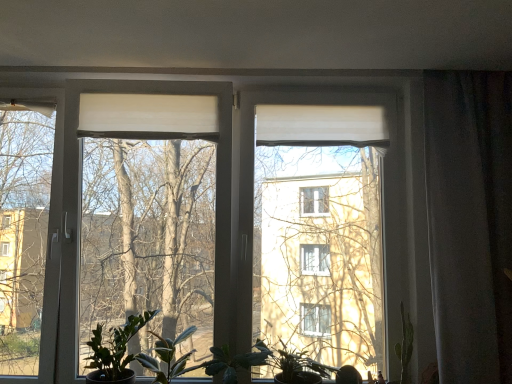
Describe the element at coordinates (169, 358) in the screenshot. I see `green matte leafy plant at lower center, arranged as the 2th houseplant when viewed from the right` at that location.

How much space does green matte plant at lower left, the first houseplant in the left-to-right sequence, occupy vertically?

It is 31.60 centimeters.

Image resolution: width=512 pixels, height=384 pixels. What do you see at coordinates (115, 351) in the screenshot? I see `green matte plant at lower left, the first houseplant in the left-to-right sequence` at bounding box center [115, 351].

This screenshot has width=512, height=384. Identify the location of green matte leafy plant at center. pos(234,361).

This screenshot has height=384, width=512. What do you see at coordinates (294, 365) in the screenshot? I see `green matte plant at lower center, marked as the first houseplant in a right-to-left arrangement` at bounding box center [294, 365].

Where is `green matte leafy plant at lower center, arranged as the 2th houseplant when viewed from the right`? Image resolution: width=512 pixels, height=384 pixels. green matte leafy plant at lower center, arranged as the 2th houseplant when viewed from the right is located at coordinates (169, 358).

Based on the photo, visually, is green matte plant at lower center, the third houseplant viewed from the left, positioned to the left or to the right of white matte curtain at right?

green matte plant at lower center, the third houseplant viewed from the left, is to the left of white matte curtain at right.

Choose the correct answer: Is green matte plant at lower center, the third houseplant viewed from the left, inside white matte curtain at right or outside it?

The correct answer is: outside.

Is green matte plant at lower center, the third houseplant viewed from the left, placed right next to white matte curtain at right?

No, green matte plant at lower center, the third houseplant viewed from the left, is not with white matte curtain at right.

Could you tell me if green matte plant at lower center, the third houseplant viewed from the left, is turned towards white matte curtain at right?

No, green matte plant at lower center, the third houseplant viewed from the left, is not turned towards white matte curtain at right.

Looking at their sizes, would you say green matte plant at lower left, the first houseplant in the left-to-right sequence, is wider or thinner than green matte leafy plant at center?

Considering their sizes, green matte plant at lower left, the first houseplant in the left-to-right sequence, looks slimmer than green matte leafy plant at center.

Is green matte plant at lower left, which appears as the 3th houseplant when viewed from the right, aimed at green matte leafy plant at center?

No, green matte plant at lower left, which appears as the 3th houseplant when viewed from the right, is not oriented towards green matte leafy plant at center.

Which is behind, point (111, 375) or point (234, 377)?

The point (234, 377) is behind.

From the image's perspective, does green matte plant at lower left, the first houseplant in the left-to-right sequence, appear lower than green matte leafy plant at center?

No, from the image's perspective, green matte plant at lower left, the first houseplant in the left-to-right sequence, is not beneath green matte leafy plant at center.

Considering the relative sizes of white matte curtain at right and green matte plant at lower left, which appears as the 3th houseplant when viewed from the right, in the image provided, is white matte curtain at right wider than green matte plant at lower left, which appears as the 3th houseplant when viewed from the right,?

Incorrect, the width of white matte curtain at right does not surpass that of green matte plant at lower left, which appears as the 3th houseplant when viewed from the right.

Is white matte curtain at right facing away from green matte plant at lower left, which appears as the 3th houseplant when viewed from the right?

That's not correct — white matte curtain at right is not looking away from green matte plant at lower left, which appears as the 3th houseplant when viewed from the right.

Considering the positions of points (437, 208) and (93, 332), is point (437, 208) closer to camera compared to point (93, 332)?

Yes.

In terms of size, does white matte curtain at right appear bigger or smaller than green matte plant at lower left, which appears as the 3th houseplant when viewed from the right?

Clearly, white matte curtain at right is larger in size than green matte plant at lower left, which appears as the 3th houseplant when viewed from the right.

From a real-world perspective, is green matte plant at lower left, the first houseplant in the left-to-right sequence, under white matte curtain at right?

Yes, from a real-world perspective, green matte plant at lower left, the first houseplant in the left-to-right sequence, is below white matte curtain at right.

Is point (122, 382) behind point (454, 233)?

That is False.

Which houseplant is the 3rd one when counting from the left side of the white matte curtain at right? Please provide its 2D coordinates.

[(115, 351)]

Is point (205, 373) farther from camera compared to point (177, 370)?

Yes, point (205, 373) is behind point (177, 370).

How much distance is there between green matte leafy plant at center and green matte leafy plant at lower center, arranged as the 2th houseplant when viewed from the right?

green matte leafy plant at center is 6.84 inches from green matte leafy plant at lower center, arranged as the 2th houseplant when viewed from the right.

Which of these two, green matte leafy plant at center or green matte leafy plant at lower center, the 2th houseplant in the left-to-right sequence, is smaller?

Smaller between the two is green matte leafy plant at center.

From the image's perspective, which is above, green matte leafy plant at center or green matte leafy plant at lower center, the 2th houseplant in the left-to-right sequence?

green matte leafy plant at lower center, the 2th houseplant in the left-to-right sequence, appears higher in the image.

Which object is positioned more to the right, green matte leafy plant at lower center, arranged as the 2th houseplant when viewed from the right, or green matte plant at lower center, marked as the first houseplant in a right-to-left arrangement?

green matte plant at lower center, marked as the first houseplant in a right-to-left arrangement, is more to the right.

From the image's perspective, which object appears higher, green matte leafy plant at lower center, arranged as the 2th houseplant when viewed from the right, or green matte plant at lower center, the third houseplant viewed from the left?

green matte leafy plant at lower center, arranged as the 2th houseplant when viewed from the right.

Would you say green matte leafy plant at lower center, arranged as the 2th houseplant when viewed from the right, is outside green matte plant at lower center, marked as the first houseplant in a right-to-left arrangement?

That's correct, green matte leafy plant at lower center, arranged as the 2th houseplant when viewed from the right, is outside of green matte plant at lower center, marked as the first houseplant in a right-to-left arrangement.

Is green matte leafy plant at lower center, arranged as the 2th houseplant when viewed from the right, shorter than green matte plant at lower center, marked as the first houseplant in a right-to-left arrangement?

Incorrect, the height of green matte leafy plant at lower center, arranged as the 2th houseplant when viewed from the right, does not fall short of that of green matte plant at lower center, marked as the first houseplant in a right-to-left arrangement.

Is green matte leafy plant at lower center, the 2th houseplant in the left-to-right sequence, in contact with green matte plant at lower left, which appears as the 3th houseplant when viewed from the right?

green matte leafy plant at lower center, the 2th houseplant in the left-to-right sequence, and green matte plant at lower left, which appears as the 3th houseplant when viewed from the right, are clearly separated.

Is point (159, 346) more distant than point (123, 345)?

No.

From a real-world perspective, between green matte leafy plant at lower center, the 2th houseplant in the left-to-right sequence, and green matte plant at lower left, which appears as the 3th houseplant when viewed from the right, who is vertically lower?

green matte leafy plant at lower center, the 2th houseplant in the left-to-right sequence, from a real-world perspective.

Considering the relative sizes of green matte leafy plant at lower center, the 2th houseplant in the left-to-right sequence, and green matte plant at lower left, which appears as the 3th houseplant when viewed from the right, in the image provided, is green matte leafy plant at lower center, the 2th houseplant in the left-to-right sequence, taller than green matte plant at lower left, which appears as the 3th houseplant when viewed from the right,?

No.

Identify the location of houseplant that is the 1st one when counting leftward from the white matte curtain at right. (294, 365).

Which houseplant is the 3rd one when counting from the back of the green matte leafy plant at center? Please provide its 2D coordinates.

[(115, 351)]

From the image, which object appears to be farther from green matte leafy plant at center, green matte plant at lower center, the third houseplant viewed from the left, or white matte curtain at right?

Based on the image, white matte curtain at right appears to be further to green matte leafy plant at center.

Estimate the real-world distances between objects in this image. Which object is further from green matte plant at lower center, the third houseplant viewed from the left, green matte leafy plant at lower center, the 2th houseplant in the left-to-right sequence, or white matte curtain at right?

The object further to green matte plant at lower center, the third houseplant viewed from the left, is white matte curtain at right.

From the image, which object appears to be nearer to green matte leafy plant at lower center, the 2th houseplant in the left-to-right sequence, green matte plant at lower center, marked as the first houseplant in a right-to-left arrangement, or green matte leafy plant at center?

green matte leafy plant at center.

Considering their positions, is green matte plant at lower center, marked as the first houseplant in a right-to-left arrangement, positioned further to green matte leafy plant at center than green matte plant at lower left, which appears as the 3th houseplant when viewed from the right?

Among the two, green matte plant at lower left, which appears as the 3th houseplant when viewed from the right, is located further to green matte leafy plant at center.

Estimate the real-world distances between objects in this image. Which object is closer to green matte leafy plant at center, green matte leafy plant at lower center, the 2th houseplant in the left-to-right sequence, or white matte curtain at right?

Among the two, green matte leafy plant at lower center, the 2th houseplant in the left-to-right sequence, is located nearer to green matte leafy plant at center.

Which object lies further to the anchor point white matte curtain at right, green matte plant at lower left, which appears as the 3th houseplant when viewed from the right, or green matte plant at lower center, the third houseplant viewed from the left?

green matte plant at lower left, which appears as the 3th houseplant when viewed from the right, is further to white matte curtain at right.

Based on their spatial positions, is green matte plant at lower center, the third houseplant viewed from the left, or green matte leafy plant at lower center, the 2th houseplant in the left-to-right sequence, further from green matte plant at lower left, the first houseplant in the left-to-right sequence?

green matte plant at lower center, the third houseplant viewed from the left, is positioned further to the anchor green matte plant at lower left, the first houseplant in the left-to-right sequence.

From the image, which object appears to be farther from green matte plant at lower left, which appears as the 3th houseplant when viewed from the right, white matte curtain at right or green matte leafy plant at lower center, arranged as the 2th houseplant when viewed from the right?

white matte curtain at right.

In order to click on plant between green matte plant at lower left, the first houseplant in the left-to-right sequence, and white matte curtain at right from left to right in this screenshot , I will do [x=234, y=361].

You are a GUI agent. You are given a task and a screenshot of the screen. Output one action in this format:
    pyautogui.click(x=<x>, y=<y>)
    Task: Click on the plant between green matte plant at lower left, which appears as the 3th houseplant when viewed from the right, and green matte plant at lower center, the third houseplant viewed from the left
    
    Given the screenshot: What is the action you would take?
    pyautogui.click(x=234, y=361)

The width and height of the screenshot is (512, 384). I want to click on houseplant between green matte leafy plant at center and white matte curtain at right, so click(x=294, y=365).

Identify the location of plant located between green matte leafy plant at lower center, the 2th houseplant in the left-to-right sequence, and white matte curtain at right in the left-right direction. This screenshot has width=512, height=384. (234, 361).